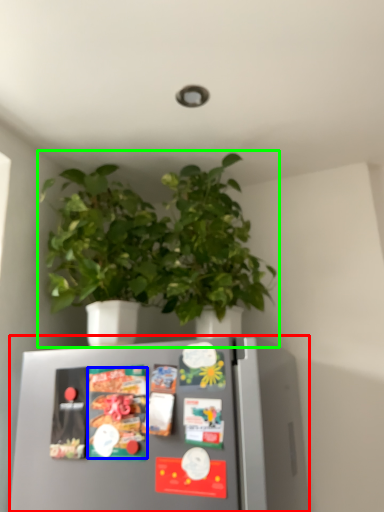
Question: Which is nearer to the refrigerator (highlighted by a red box)? food (highlighted by a blue box) or houseplant (highlighted by a green box).

Choices:
 (A) food
 (B) houseplant

Answer: (A)